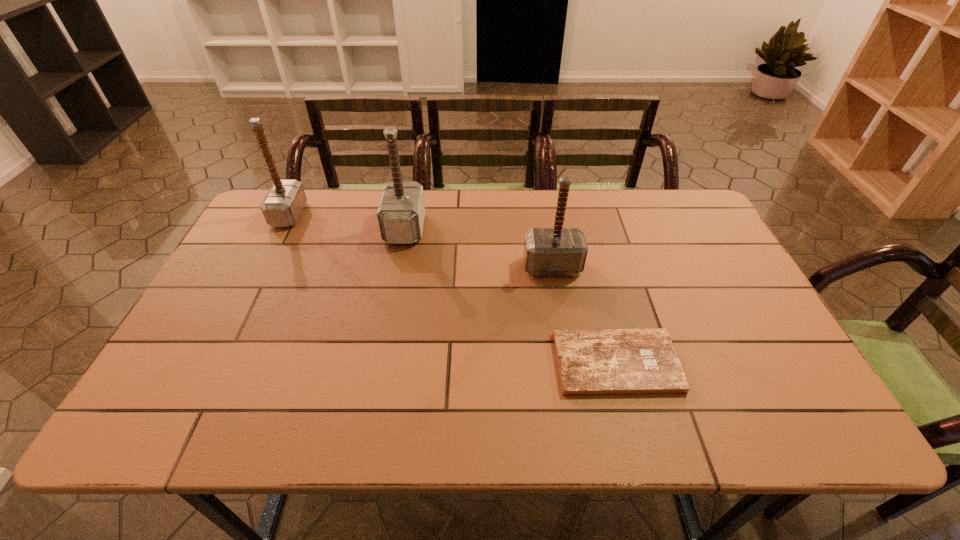
Identify the location of object located at the left edge. This screenshot has height=540, width=960. (282, 206).

Identify the location of object located in the far left corner section of the desktop. (282, 206).

In the image, there is a desktop. In order to click on vacant space at the far edge in this screenshot , I will do `click(599, 211)`.

In order to click on vacant region at the left edge in this screenshot , I will do 271,272.

In order to click on vacant area at the right edge of the desktop in this screenshot , I will do tap(693, 300).

In the image, there is a desktop. Find the location of `free space at the far left corner`. free space at the far left corner is located at coordinates (247, 230).

At what (x,y) coordinates should I click in order to perform the action: click on blank area at the far right corner. Please return your answer as a coordinate pair (x, y). Image resolution: width=960 pixels, height=540 pixels. Looking at the image, I should click on (677, 218).

Find the location of a particular element. The image size is (960, 540). vacant region between the nearest hammer and the leftmost object is located at coordinates (420, 241).

Find the location of a particular element. vacant space that is in between the shortest object and the second object from left to right is located at coordinates (510, 296).

What are the coordinates of `free space between the nearest object and the leftmost hammer` in the screenshot? It's located at (451, 289).